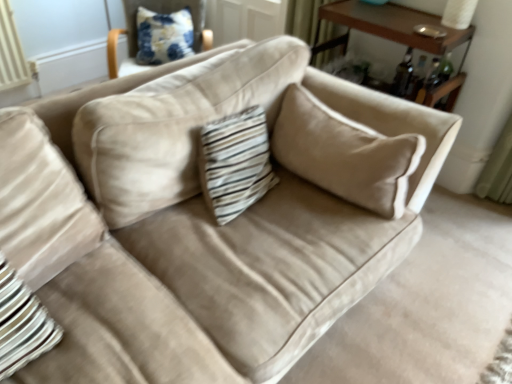
Question: Is brown wood table at upper right turned away from blue printed fabric pillow at upper left?

Choices:
 (A) no
 (B) yes

Answer: (A)

Question: Is brown wood table at upper right thinner than blue printed fabric pillow at upper left?

Choices:
 (A) yes
 (B) no

Answer: (B)

Question: Does brown wood table at upper right contain blue printed fabric pillow at upper left?

Choices:
 (A) no
 (B) yes

Answer: (A)

Question: Is brown wood table at upper right at the left side of blue printed fabric pillow at upper left?

Choices:
 (A) no
 (B) yes

Answer: (A)

Question: Considering the relative sizes of brown wood table at upper right and blue printed fabric pillow at upper left in the image provided, is brown wood table at upper right wider than blue printed fabric pillow at upper left?

Choices:
 (A) no
 (B) yes

Answer: (B)

Question: From the image's perspective, is blue printed fabric pillow at upper left above or below brown wood table at upper right?

Choices:
 (A) below
 (B) above

Answer: (B)

Question: Is blue printed fabric pillow at upper left taller or shorter than brown wood table at upper right?

Choices:
 (A) tall
 (B) short

Answer: (B)

Question: In the image, is blue printed fabric pillow at upper left positioned in front of or behind brown wood table at upper right?

Choices:
 (A) front
 (B) behind

Answer: (B)

Question: Considering the positions of point (143, 46) and point (442, 92), is point (143, 46) closer or farther from the camera than point (442, 92)?

Choices:
 (A) farther
 (B) closer

Answer: (A)

Question: Which is correct: white paper lampshade at upper right is inside blue printed fabric pillow at upper left, or outside of it?

Choices:
 (A) outside
 (B) inside

Answer: (A)

Question: Is white paper lampshade at upper right wider or thinner than blue printed fabric pillow at upper left?

Choices:
 (A) thin
 (B) wide

Answer: (A)

Question: In terms of height, does white paper lampshade at upper right look taller or shorter compared to blue printed fabric pillow at upper left?

Choices:
 (A) short
 (B) tall

Answer: (A)

Question: From the image's perspective, relative to blue printed fabric pillow at upper left, is white paper lampshade at upper right above or below?

Choices:
 (A) above
 (B) below

Answer: (B)

Question: Considering the positions of brown wood table at upper right and white paper lampshade at upper right in the image, is brown wood table at upper right wider or thinner than white paper lampshade at upper right?

Choices:
 (A) wide
 (B) thin

Answer: (A)

Question: From the image's perspective, is brown wood table at upper right above or below white paper lampshade at upper right?

Choices:
 (A) above
 (B) below

Answer: (B)